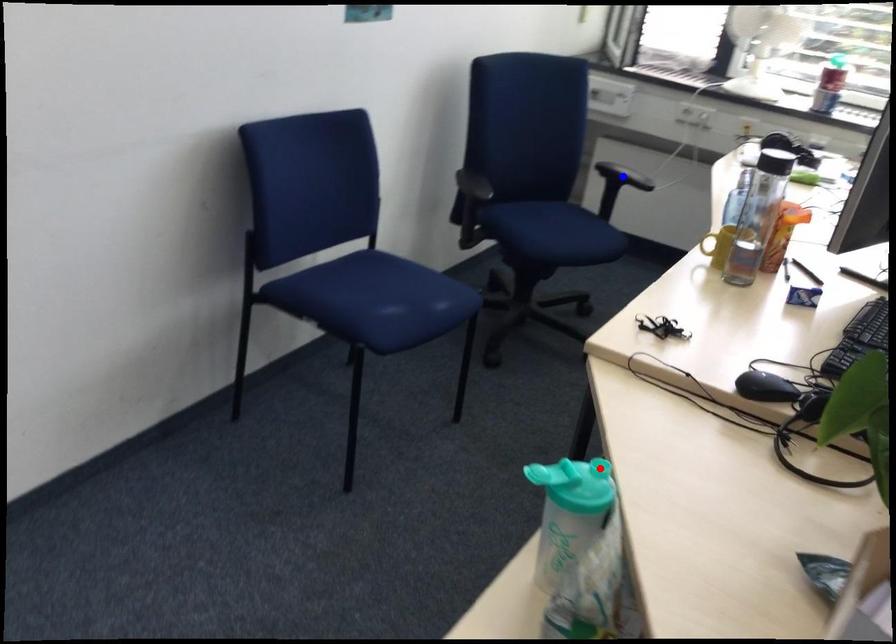
Question: In the image, two points are highlighted. Which point is nearer to the camera? Reply with the corresponding letter.

Choices:
 (A) blue point
 (B) red point

Answer: (B)